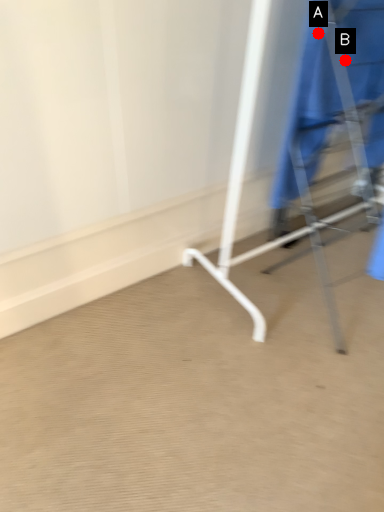
Question: Two points are circled on the image, labeled by A and B beside each circle. Which point is farther from the camera taking this photo?

Choices:
 (A) A is further
 (B) B is further

Answer: (B)